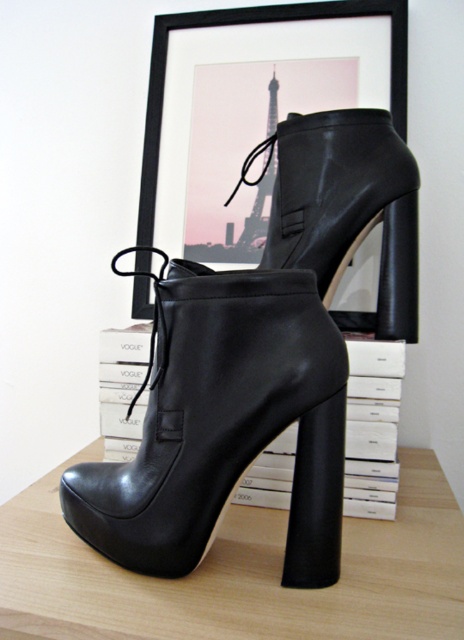
Between black matte frame at upper center and metallic silver eiffel tower at center, which one has more height?

black matte frame at upper center

Who is higher up, black matte frame at upper center or metallic silver eiffel tower at center?

black matte frame at upper center

The width and height of the screenshot is (464, 640). In order to click on black matte frame at upper center in this screenshot , I will do `click(258, 22)`.

Who is positioned more to the left, black leather boot at center or metallic silver eiffel tower at center?

black leather boot at center

Does black leather boot at center appear under metallic silver eiffel tower at center?

Yes.

Locate an element on the screen. This screenshot has height=640, width=464. black leather boot at center is located at coordinates (224, 422).

Find the location of a particular element. black leather boot at center is located at coordinates (224, 422).

Does black leather boot at center have a lesser height compared to black matte frame at upper center?

Indeed, black leather boot at center has a lesser height compared to black matte frame at upper center.

Does black leather boot at center have a smaller size compared to black matte frame at upper center?

Indeed, black leather boot at center has a smaller size compared to black matte frame at upper center.

The height and width of the screenshot is (640, 464). What do you see at coordinates (224, 422) in the screenshot? I see `black leather boot at center` at bounding box center [224, 422].

This screenshot has width=464, height=640. What are the coordinates of `black leather boot at center` in the screenshot? It's located at (224, 422).